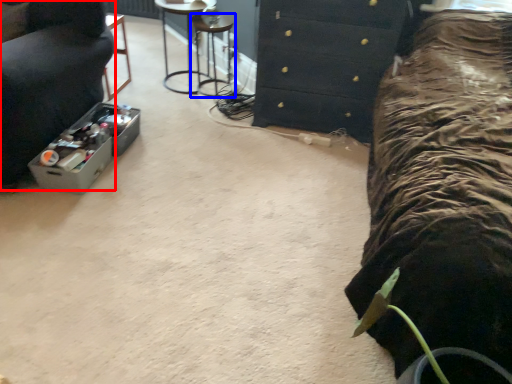
Question: Which object is closer to the camera taking this photo, furniture (highlighted by a red box) or bar stool (highlighted by a blue box)?

Choices:
 (A) furniture
 (B) bar stool

Answer: (A)